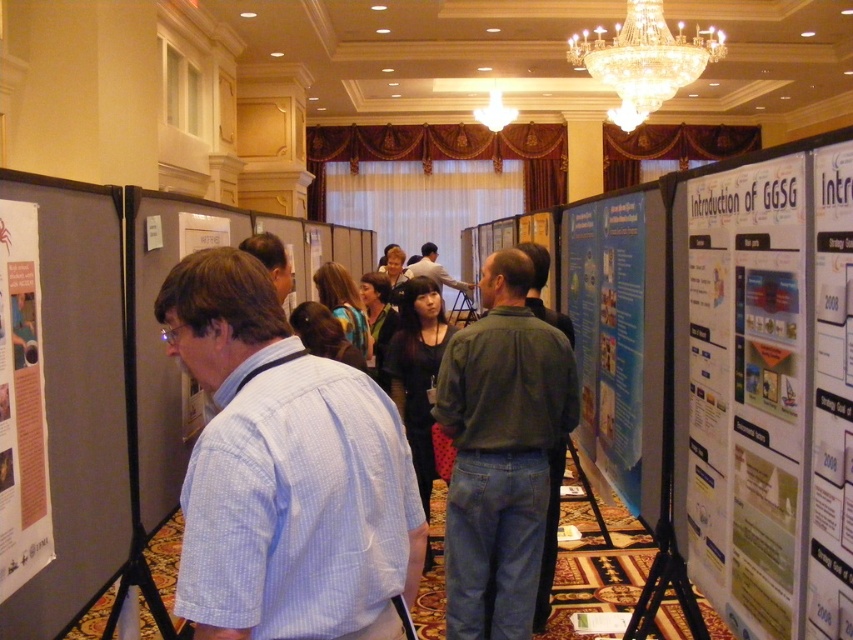
Who is positioned more to the right, crystal at upper center or dark gray shirt at center?

crystal at upper center

Can you confirm if crystal at upper center is shorter than dark gray shirt at center?

Correct, crystal at upper center is not as tall as dark gray shirt at center.

At what (x,y) coordinates should I click in order to perform the action: click on crystal at upper center. Please return your answer as a coordinate pair (x, y). This screenshot has height=640, width=853. Looking at the image, I should click on (643, 60).

Consider the image. Can you confirm if matte white poster at center right is thinner than dark gray shirt at center?

Yes, matte white poster at center right is thinner than dark gray shirt at center.

Does point (842, 636) come in front of point (432, 244)?

Yes, point (842, 636) is closer to viewer.

Is point (817, 593) closer to camera compared to point (432, 262)?

Yes, point (817, 593) is closer to viewer.

You are a GUI agent. You are given a task and a screenshot of the screen. Output one action in this format:
    pyautogui.click(x=<x>, y=<y>)
    Task: Click on the matte white poster at center right
    
    Given the screenshot: What is the action you would take?
    pyautogui.click(x=831, y=401)

The height and width of the screenshot is (640, 853). What do you see at coordinates (283, 472) in the screenshot?
I see `light blue shirt at center` at bounding box center [283, 472].

Is light blue shirt at center taller than crystal at upper center?

No, light blue shirt at center is not taller than crystal at upper center.

What are the coordinates of `light blue shirt at center` in the screenshot? It's located at (283, 472).

At what (x,y) coordinates should I click in order to perform the action: click on light blue shirt at center. Please return your answer as a coordinate pair (x, y). Image resolution: width=853 pixels, height=640 pixels. Looking at the image, I should click on (283, 472).